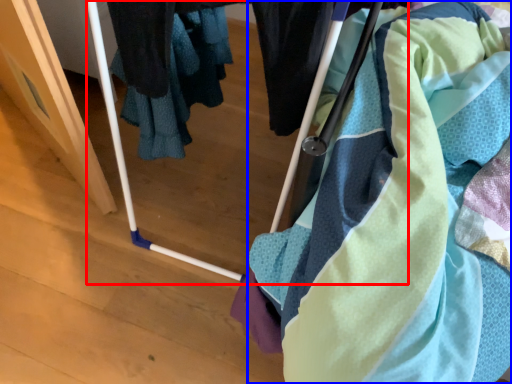
Question: Among these objects, which one is nearest to the camera, baby carriage (highlighted by a red box) or towel (highlighted by a blue box)?

Choices:
 (A) baby carriage
 (B) towel

Answer: (A)